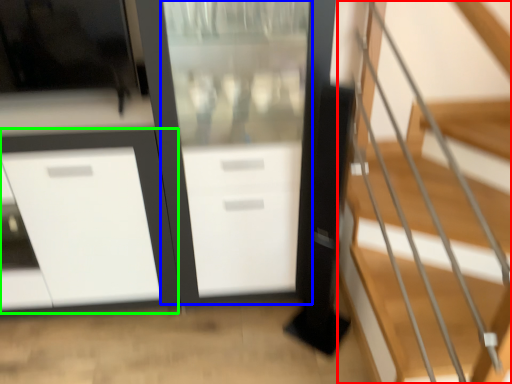
Question: Based on their relative distances, which object is farther from stairs (highlighted by a red box)? Choose from screen door (highlighted by a blue box) and cabinetry (highlighted by a green box).

Choices:
 (A) screen door
 (B) cabinetry

Answer: (B)